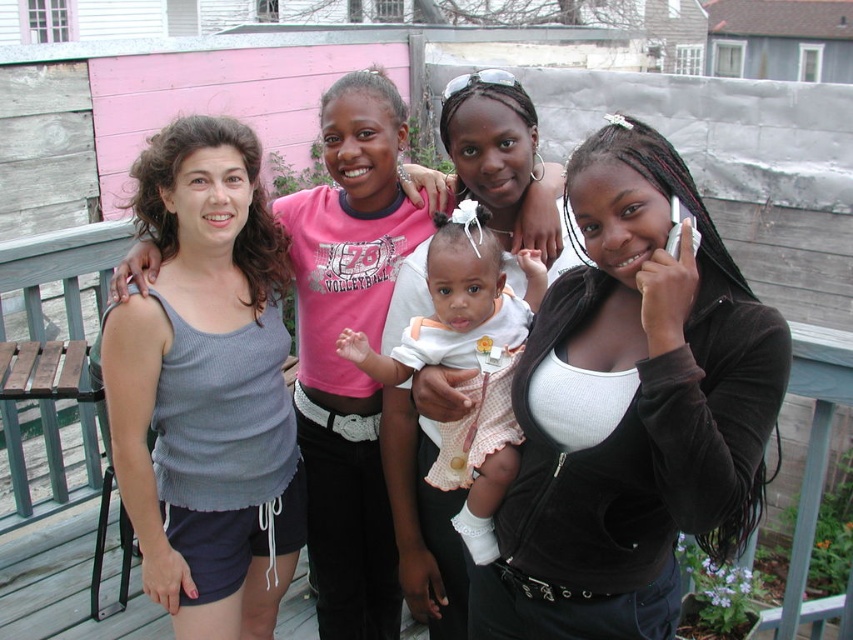
Is point (44, 572) behind point (465, 541)?

Yes, point (44, 572) is farther from viewer.

Does wooden deck at center have a lesser width compared to white polka dot dress at center?

No.

Is point (809, 609) closer to viewer compared to point (465, 426)?

No, it is behind (465, 426).

Identify the location of wooden deck at center. Image resolution: width=853 pixels, height=640 pixels. (64, 592).

The image size is (853, 640). What do you see at coordinates (207, 387) in the screenshot? I see `gray ribbed tank top at center` at bounding box center [207, 387].

Measure the distance between point (x=222, y=332) and camera.

Point (x=222, y=332) and camera are 6.78 feet apart.

Between point (180, 540) and point (86, 253), which one is positioned behind?

Point (86, 253)

Find the location of a particular element. gray ribbed tank top at center is located at coordinates (207, 387).

Does point (759, 392) come behind point (163, 294)?

That is False.

Is black velvet jacket at upper right taller than gray ribbed tank top at center?

No, black velvet jacket at upper right is not taller than gray ribbed tank top at center.

Which is behind, point (517, 545) or point (228, 173)?

Positioned behind is point (228, 173).

Find the location of a particular element. This screenshot has width=853, height=640. black velvet jacket at upper right is located at coordinates (631, 412).